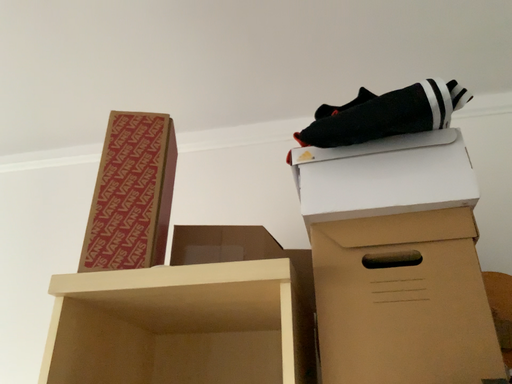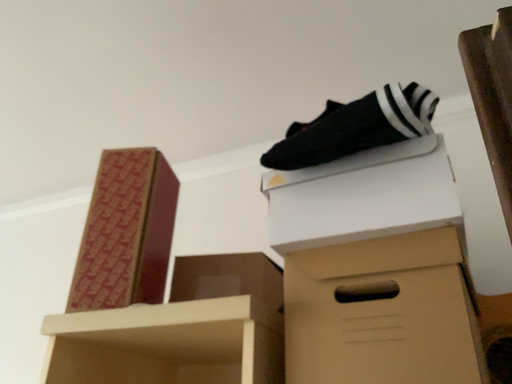
Question: Which way did the camera rotate in the video?

Choices:
 (A) rotated right
 (B) rotated left

Answer: (B)